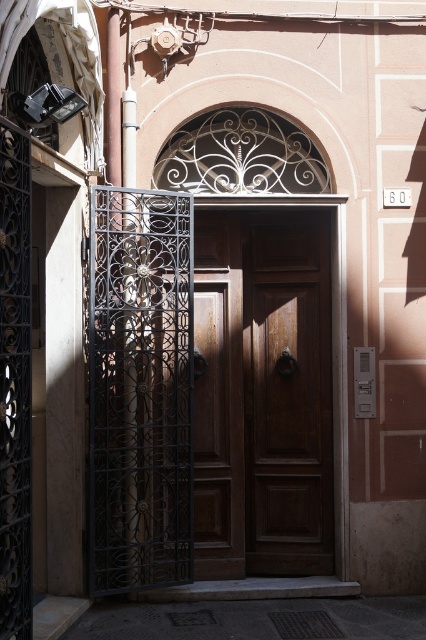
Question: Which of the following is the farthest from the observer?

Choices:
 (A) (224, 248)
 (B) (132, 436)

Answer: (A)

Question: Which of the following is the closest to the observer?

Choices:
 (A) (215, 483)
 (B) (129, 298)

Answer: (B)

Question: From the image, what is the correct spatial relationship of polished wood door at center in relation to black wrought iron gate at left?

Choices:
 (A) right
 (B) left

Answer: (A)

Question: Which object is farther from the camera taking this photo?

Choices:
 (A) polished wood door at center
 (B) black wrought iron gate at left

Answer: (A)

Question: Where is polished wood door at center located in relation to black wrought iron gate at left in the image?

Choices:
 (A) below
 (B) above

Answer: (A)

Question: Is polished wood door at center closer to the viewer compared to black wrought iron gate at left?

Choices:
 (A) yes
 (B) no

Answer: (B)